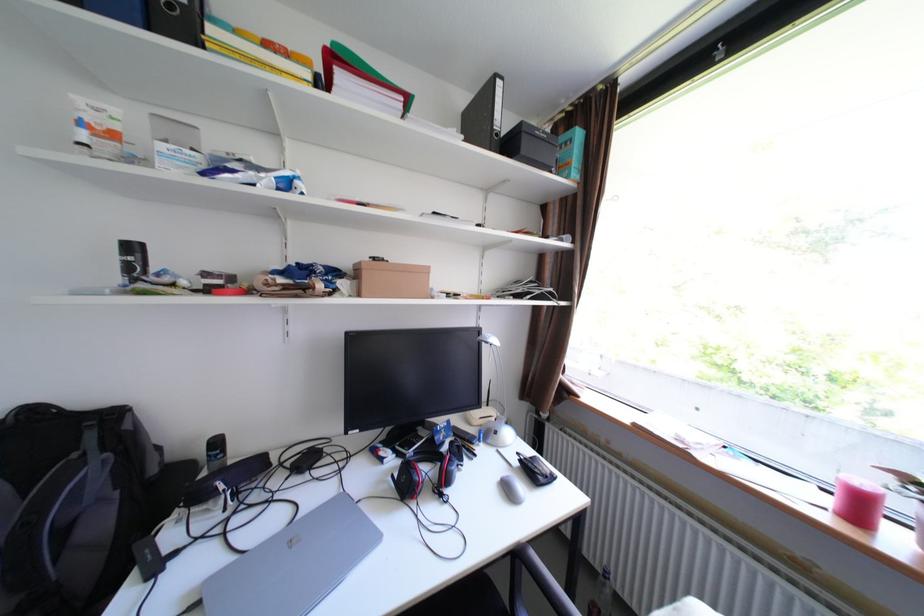
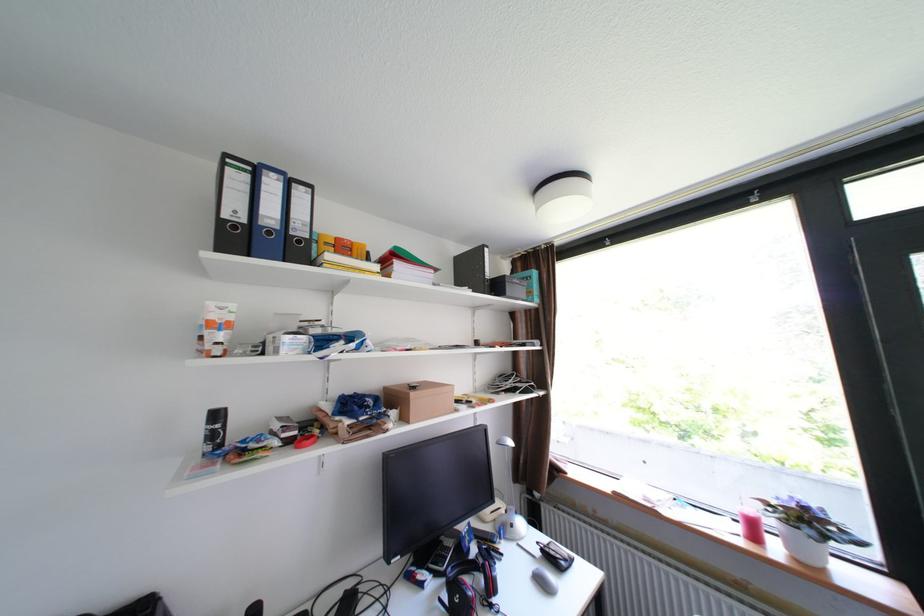
In the second image, find the point that corresponds to point (531, 461) in the first image.

(553, 551)